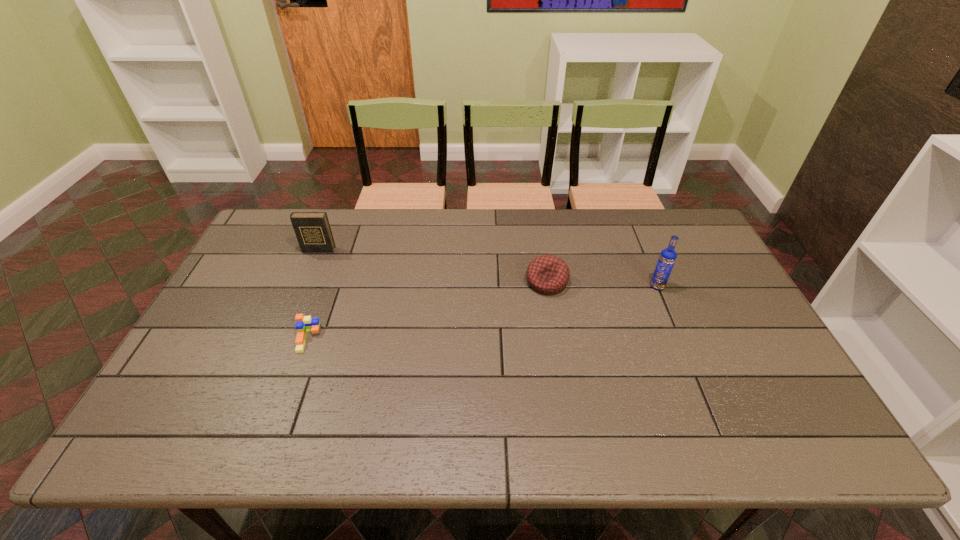
The width and height of the screenshot is (960, 540). In order to click on free region that satisfies the following two spatial constraints: 1. on the front cover of the diary; 2. on the right side of the vodka in this screenshot , I will do `click(303, 286)`.

Locate an element on the screen. The width and height of the screenshot is (960, 540). free region that satisfies the following two spatial constraints: 1. on the back side of the second shortest object; 2. on the right side of the nearest object is located at coordinates (328, 282).

Find the location of a particular element. vacant area in the image that satisfies the following two spatial constraints: 1. on the front cover of the second tallest object; 2. on the left side of the nearest object is located at coordinates (281, 339).

This screenshot has height=540, width=960. What are the coordinates of `vacant region that satisfies the following two spatial constraints: 1. on the front cover of the second tallest object; 2. on the right side of the tallest object` in the screenshot? It's located at [303, 286].

You are a GUI agent. You are given a task and a screenshot of the screen. Output one action in this format:
    pyautogui.click(x=<x>, y=<y>)
    Task: Click on the vacant region that satisfies the following two spatial constraints: 1. on the front cover of the third shortest object; 2. on the right side of the third object from left to right
    This screenshot has height=540, width=960.
    Given the screenshot: What is the action you would take?
    pyautogui.click(x=305, y=282)

Locate an element on the screen. blank area in the image that satisfies the following two spatial constraints: 1. on the front cover of the beanbag; 2. on the left side of the farthest object is located at coordinates (305, 282).